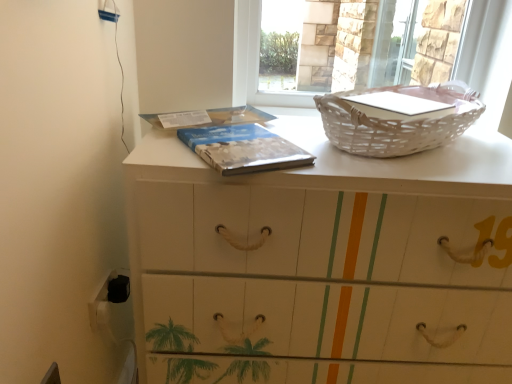
The image size is (512, 384). I want to click on vacant space that is to the left of blue textured book at center, so click(165, 149).